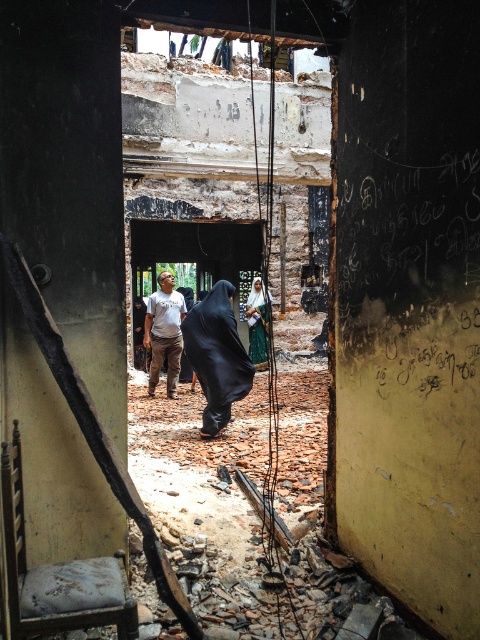
You are standing in the damaged building and notice two points marked in the scene. Which point, point (159, 353) or point (267, 321), is closer to you?

Point (159, 353) is closer to the viewer than point (267, 321).